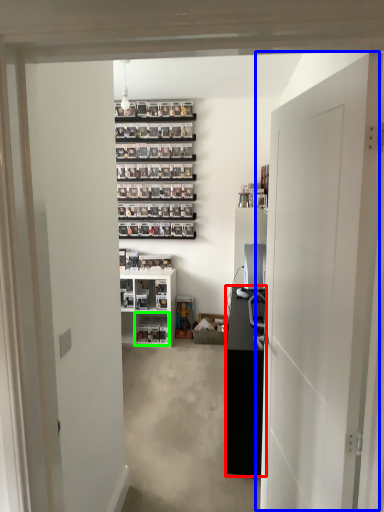
Question: Which object is the closest to the cabinetry (highlighted by a red box)? Choose among these: door (highlighted by a blue box) or shelf (highlighted by a green box).

Choices:
 (A) door
 (B) shelf

Answer: (A)